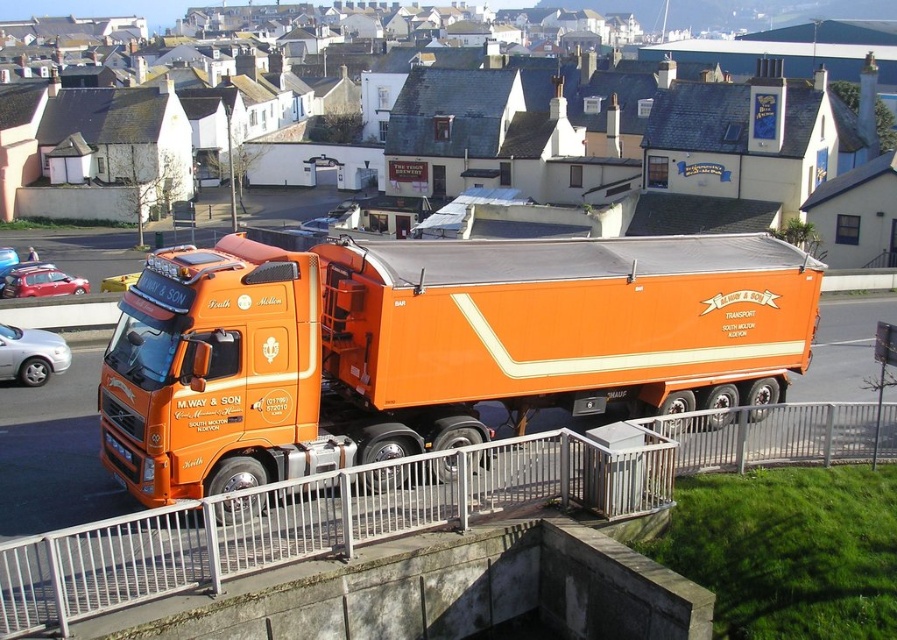
Question: Does orange matte truck at center come behind silver metallic sedan at lower left?

Choices:
 (A) yes
 (B) no

Answer: (B)

Question: Estimate the real-world distances between objects in this image. Which object is closer to the white metal railing at center?

Choices:
 (A) orange matte truck at center
 (B) shiny red car at left
 (C) silver metallic sedan at lower left

Answer: (A)

Question: Among these objects, which one is farthest from the camera?

Choices:
 (A) white metal railing at center
 (B) silver metallic sedan at lower left
 (C) orange matte truck at center

Answer: (B)

Question: Which object is closer to the camera taking this photo?

Choices:
 (A) shiny red car at left
 (B) orange matte truck at center
 (C) white metal railing at center

Answer: (C)

Question: Is orange matte truck at center smaller than white metal railing at center?

Choices:
 (A) yes
 (B) no

Answer: (B)

Question: Does orange matte truck at center appear on the right side of white metal railing at center?

Choices:
 (A) no
 (B) yes

Answer: (A)